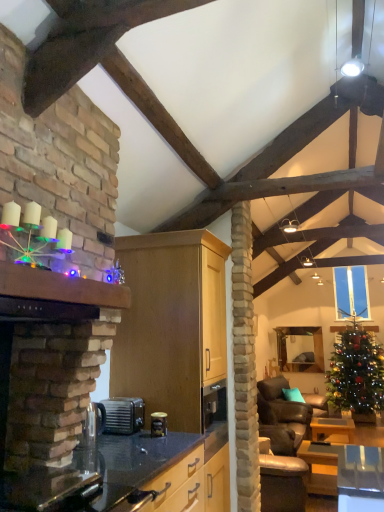
Question: Relative to black granite countertop at center, is wooden table at lower right, which ranks as the 1th table in back-to-front order, in front or behind?

Choices:
 (A) behind
 (B) front

Answer: (A)

Question: From a real-world perspective, is wooden table at lower right, which ranks as the 1th table in back-to-front order, positioned above or below black granite countertop at center?

Choices:
 (A) below
 (B) above

Answer: (A)

Question: Which is nearer to the wooden table at lower right, which is the second table in front-to-back order?

Choices:
 (A) wooden mantle at upper left
 (B) wooden table at lower right, which ranks as the first table in front-to-back order
 (C) clear glass carafe at lower left, the third appliance when ordered from back to front
 (D) leather couch at lower right
 (E) matte wood cabinet at center

Answer: (D)

Question: Estimate the real-world distances between objects in this image. Which object is closer to the green glossy christmas tree at right?

Choices:
 (A) wooden table at lower right, which ranks as the first table in front-to-back order
 (B) wooden mantle at upper left
 (C) matte wood cabinet at center
 (D) clear glass carafe at lower left, which appears as the third appliance when viewed from the right
 (E) clear glass window at upper center

Answer: (E)